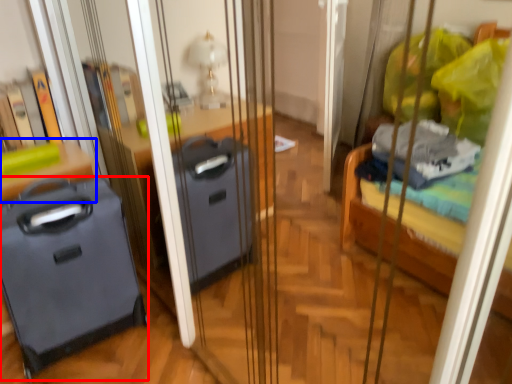
Question: Which object appears farthest to the camera in this image, luggage (highlighted by a red box) or furniture (highlighted by a blue box)?

Choices:
 (A) luggage
 (B) furniture

Answer: (B)